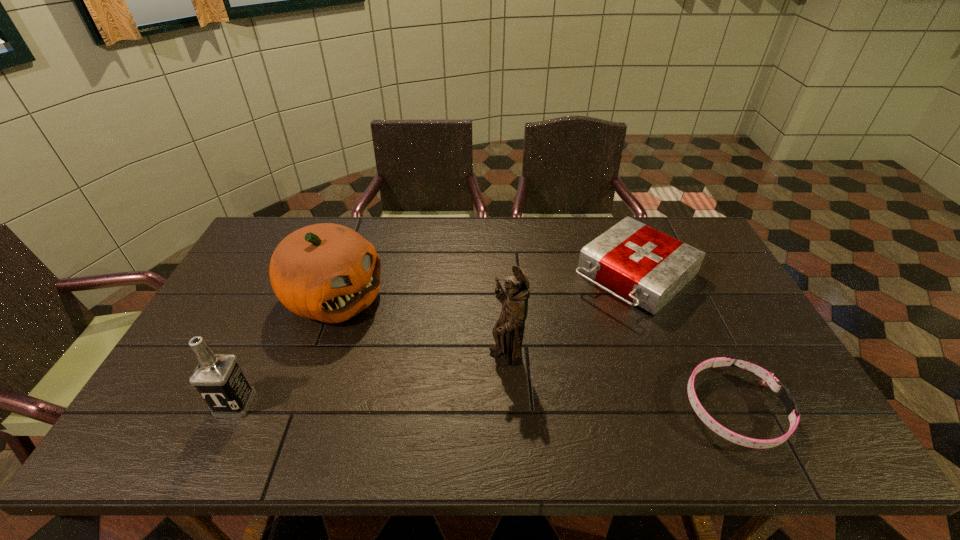
In order to click on free space between the vodka and the first-aid kit in this screenshot , I will do `click(435, 340)`.

At what (x,y) coordinates should I click in order to perform the action: click on vacant space that is in between the vodka and the tallest object. Please return your answer as a coordinate pair (x, y). The height and width of the screenshot is (540, 960). Looking at the image, I should click on (372, 379).

Where is `unoccupied area between the vodka and the pumpkin`? The image size is (960, 540). unoccupied area between the vodka and the pumpkin is located at coordinates (284, 350).

You are a GUI agent. You are given a task and a screenshot of the screen. Output one action in this format:
    pyautogui.click(x=<x>, y=<y>)
    Task: Click on the empty space between the figurine and the vodka
    
    Given the screenshot: What is the action you would take?
    pyautogui.click(x=372, y=379)

You are a GUI agent. You are given a task and a screenshot of the screen. Output one action in this format:
    pyautogui.click(x=<x>, y=<y>)
    Task: Click on the vacant space in between the fourth tallest object and the pumpkin
    
    Given the screenshot: What is the action you would take?
    pyautogui.click(x=484, y=286)

What are the coordinates of `free spot between the pumpkin and the first-aid kit` in the screenshot? It's located at (484, 286).

The image size is (960, 540). I want to click on vacant space that's between the pumpkin and the dog collar, so click(534, 353).

Where is `unoccupied area between the shortest object and the pumpkin`? unoccupied area between the shortest object and the pumpkin is located at coordinates (534, 353).

The height and width of the screenshot is (540, 960). In order to click on the third closest object to the pumpkin in this screenshot , I will do coord(648,267).

Locate which object is the closest to the vodka. Please provide its 2D coordinates. Your answer should be formatted as a tuple, i.e. [(x, y)], where the tuple contains the x and y coordinates of a point satisfying the conditions above.

[(327, 272)]